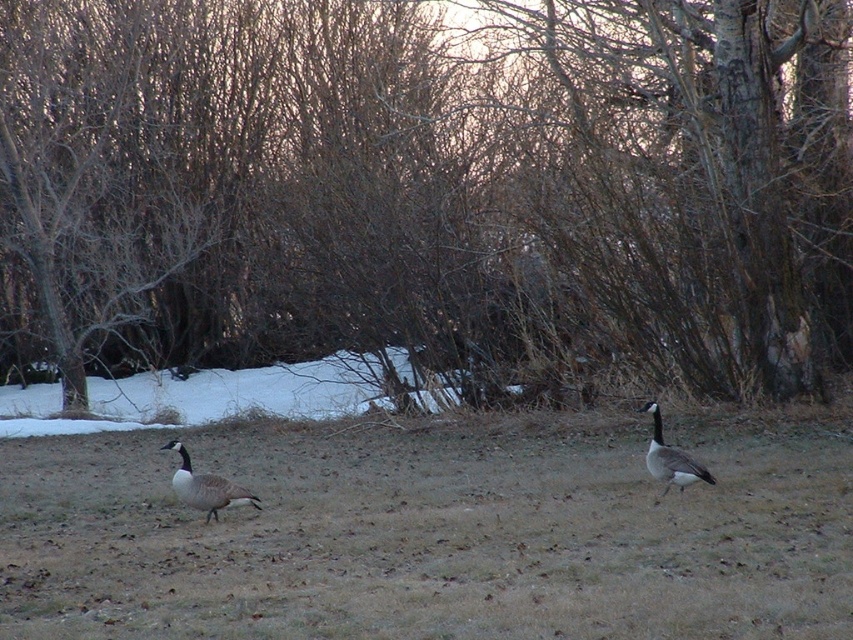
Between white powder snow at center and gray matte goose at lower left, which one has less height?

gray matte goose at lower left

Can you confirm if white powder snow at center is positioned to the right of gray matte goose at lower left?

No, white powder snow at center is not to the right of gray matte goose at lower left.

Locate an element on the screen. The image size is (853, 640). white powder snow at center is located at coordinates (198, 397).

Locate an element on the screen. The image size is (853, 640). white powder snow at center is located at coordinates (198, 397).

Between brown dry grass at center and white powder snow at center, which one is positioned higher?

white powder snow at center

Which of these two, brown dry grass at center or white powder snow at center, stands taller?

white powder snow at center is taller.

Which is behind, point (256, 468) or point (138, 401)?

The point (138, 401) is behind.

I want to click on brown dry grass at center, so click(431, 536).

Does brown dry grass at center appear over gray matte goose at lower left?

Correct, brown dry grass at center is located above gray matte goose at lower left.

Is point (733, 538) positioned in front of point (186, 452)?

Yes, it is.

At what (x,y) coordinates should I click in order to perform the action: click on brown dry grass at center. Please return your answer as a coordinate pair (x, y). Looking at the image, I should click on (431, 536).

Where is `brown dry grass at center`? The image size is (853, 640). brown dry grass at center is located at coordinates (431, 536).